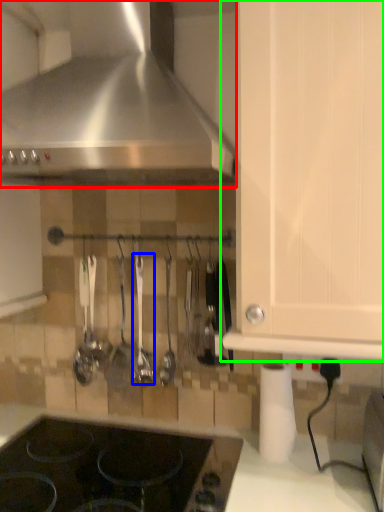
Question: Which object is the closest to the kitchen appliance (highlighted by a red box)? Choose among these: silverware (highlighted by a blue box) or cabinetry (highlighted by a green box).

Choices:
 (A) silverware
 (B) cabinetry

Answer: (B)